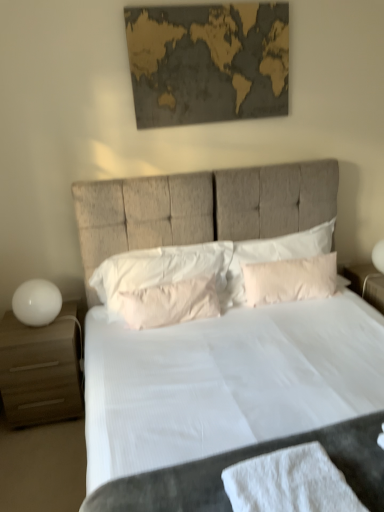
Question: Does white soft pillow at center, which appears as the 3th pillow when viewed from the right, have a greater height compared to pink fabric pillow at center, acting as the third pillow starting from the left?

Choices:
 (A) no
 (B) yes

Answer: (A)

Question: From a real-world perspective, is white soft pillow at center, which appears as the 3th pillow when viewed from the right, on pink fabric pillow at center, arranged as the first pillow when viewed from the right?

Choices:
 (A) yes
 (B) no

Answer: (B)

Question: Is pink fabric pillow at center, arranged as the first pillow when viewed from the right, a part of white soft pillow at center, which appears as the 3th pillow when viewed from the right?

Choices:
 (A) no
 (B) yes

Answer: (A)

Question: Is white soft pillow at center, which appears as the 3th pillow when viewed from the right, looking in the opposite direction of pink fabric pillow at center, acting as the third pillow starting from the left?

Choices:
 (A) no
 (B) yes

Answer: (A)

Question: Is white soft pillow at center, which appears as the 3th pillow when viewed from the right, touching pink fabric pillow at center, acting as the third pillow starting from the left?

Choices:
 (A) yes
 (B) no

Answer: (B)

Question: Considering their positions, is pink fabric pillow at center, which appears as the second pillow when viewed from the right, located in front of or behind white fabric bed at center?

Choices:
 (A) front
 (B) behind

Answer: (B)

Question: Would you say pink fabric pillow at center, which appears as the second pillow when viewed from the right, is inside or outside white fabric bed at center?

Choices:
 (A) inside
 (B) outside

Answer: (A)

Question: From the image's perspective, is pink fabric pillow at center, placed as the second pillow when sorted from left to right, positioned above or below white fabric bed at center?

Choices:
 (A) above
 (B) below

Answer: (A)

Question: From a real-world perspective, is pink fabric pillow at center, which appears as the second pillow when viewed from the right, physically located above or below white fabric bed at center?

Choices:
 (A) above
 (B) below

Answer: (B)

Question: Considering the positions of point (110, 296) and point (49, 290), is point (110, 296) closer or farther from the camera than point (49, 290)?

Choices:
 (A) closer
 (B) farther

Answer: (B)

Question: From a real-world perspective, is white soft pillow at center, which appears as the 3th pillow when viewed from the right, physically located above or below white glossy table lamp at left?

Choices:
 (A) below
 (B) above

Answer: (B)

Question: Visually, is white soft pillow at center, positioned as the first pillow in left-to-right order, positioned to the left or to the right of white glossy table lamp at left?

Choices:
 (A) right
 (B) left

Answer: (A)

Question: Considering the positions of white soft pillow at center, which appears as the 3th pillow when viewed from the right, and white glossy table lamp at left in the image, is white soft pillow at center, which appears as the 3th pillow when viewed from the right, bigger or smaller than white glossy table lamp at left?

Choices:
 (A) big
 (B) small

Answer: (A)

Question: Is point [x=44, y=416] positioned closer to the camera than point [x=36, y=297]?

Choices:
 (A) farther
 (B) closer

Answer: (A)

Question: In terms of height, does matte wood nightstand at left look taller or shorter compared to white glossy table lamp at left?

Choices:
 (A) tall
 (B) short

Answer: (A)